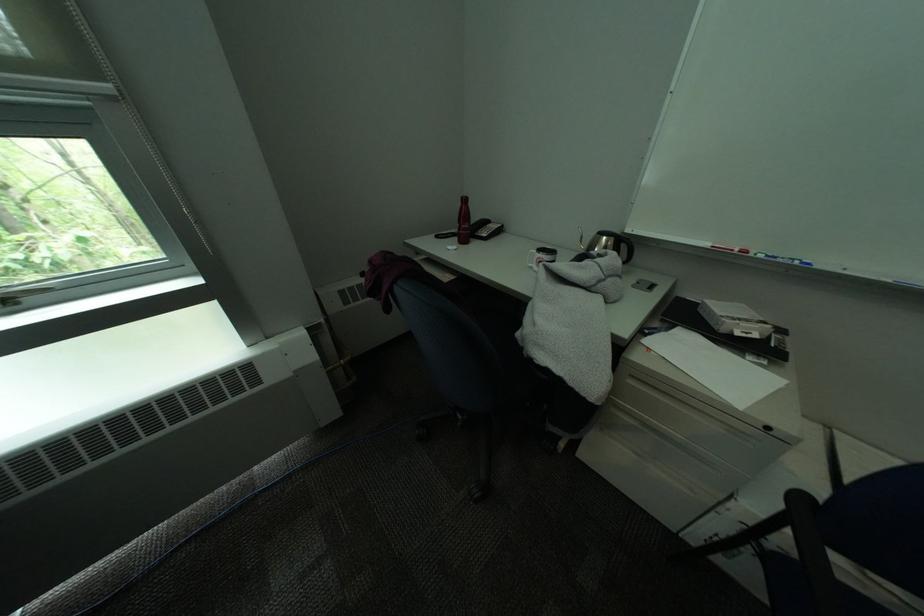
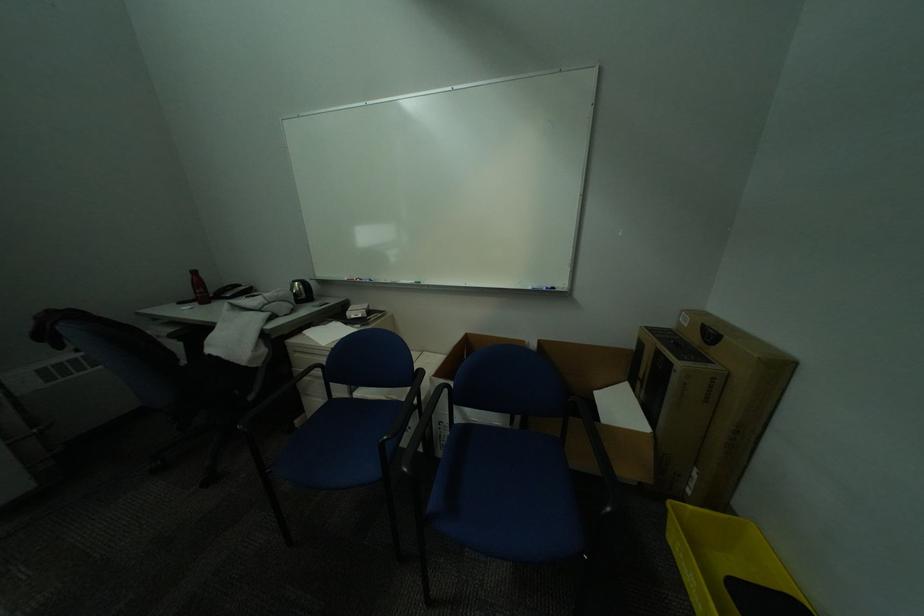
Find the pixel in the second image that matches (466,241) in the first image.

(208, 304)